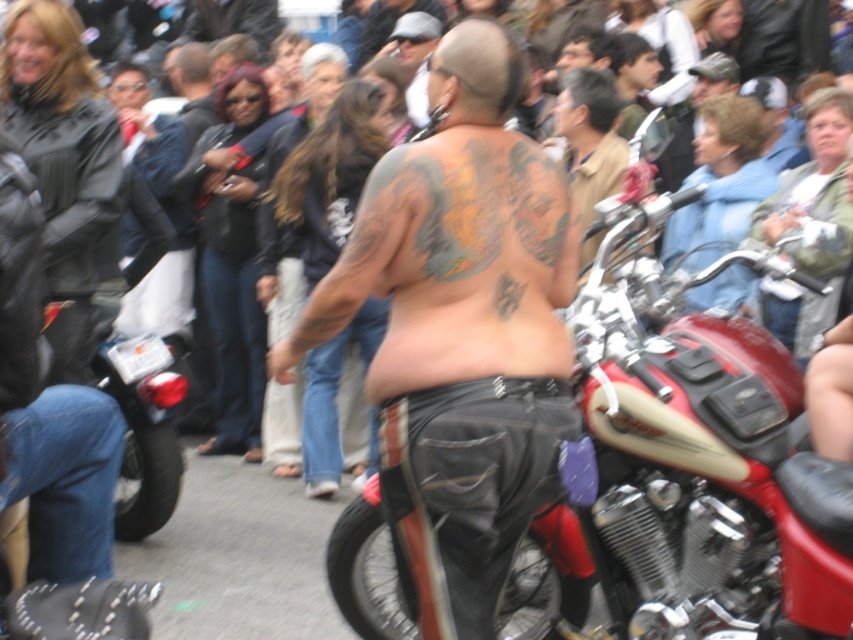
Question: Among these points, which one is nearest to the camera?

Choices:
 (A) (486, 403)
 (B) (613, 216)

Answer: (A)

Question: Does shiny chrome motorcycle at center come in front of shiny metallic tank top at center?

Choices:
 (A) no
 (B) yes

Answer: (A)

Question: Is shiny chrome motorcycle at center to the right of shiny metallic tank top at center from the viewer's perspective?

Choices:
 (A) yes
 (B) no

Answer: (A)

Question: Estimate the real-world distances between objects in this image. Which object is closer to the shiny metallic tank top at center?

Choices:
 (A) shiny silver motorcycle at center
 (B) shiny chrome motorcycle at center

Answer: (B)

Question: Considering the relative positions of shiny chrome motorcycle at center and shiny silver motorcycle at center in the image provided, where is shiny chrome motorcycle at center located with respect to shiny silver motorcycle at center?

Choices:
 (A) left
 (B) right

Answer: (A)

Question: Among these objects, which one is farthest from the camera?

Choices:
 (A) shiny metallic tank top at center
 (B) shiny silver motorcycle at center
 (C) shiny chrome motorcycle at center

Answer: (B)